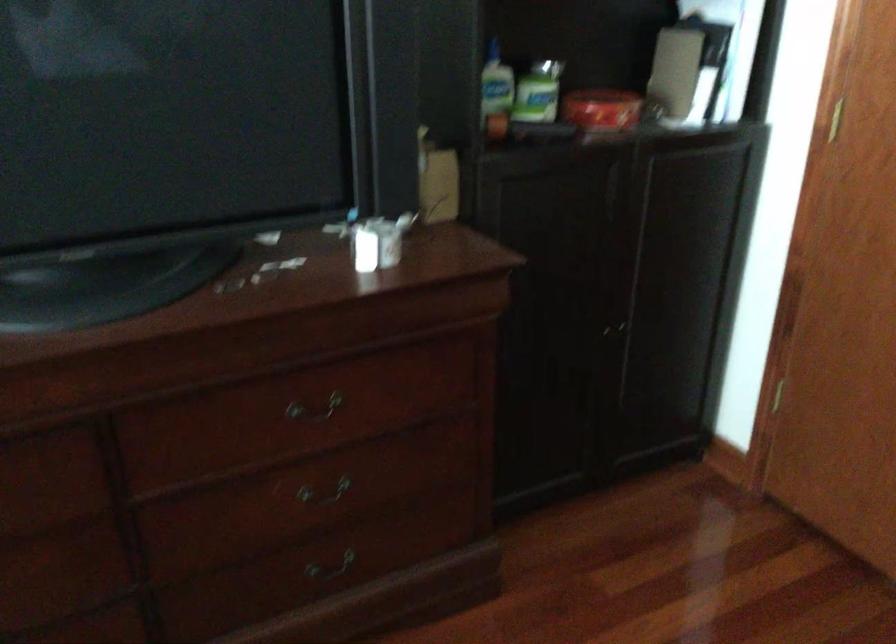
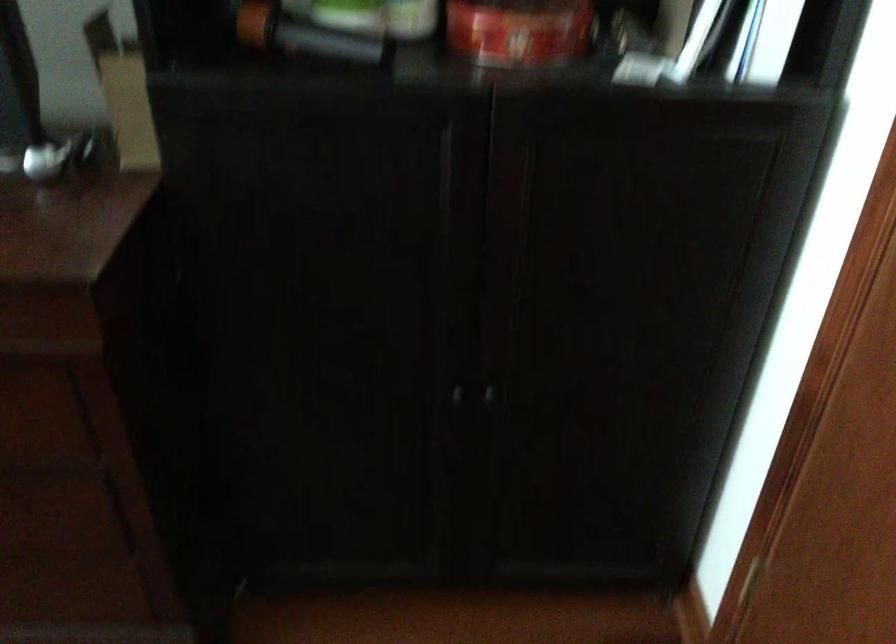
The point at (604, 336) is marked in the first image. Where is the corresponding point in the second image?

(457, 395)